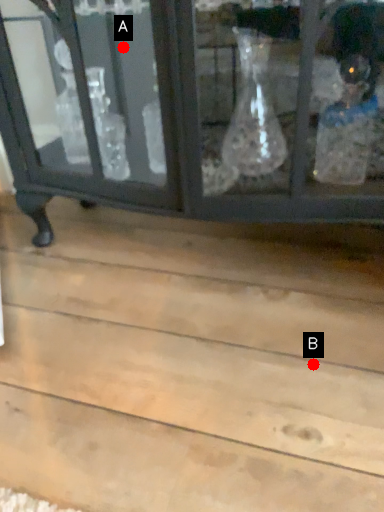
Question: Two points are circled on the image, labeled by A and B beside each circle. Which point appears farthest from the camera in this image?

Choices:
 (A) A is further
 (B) B is further

Answer: (A)